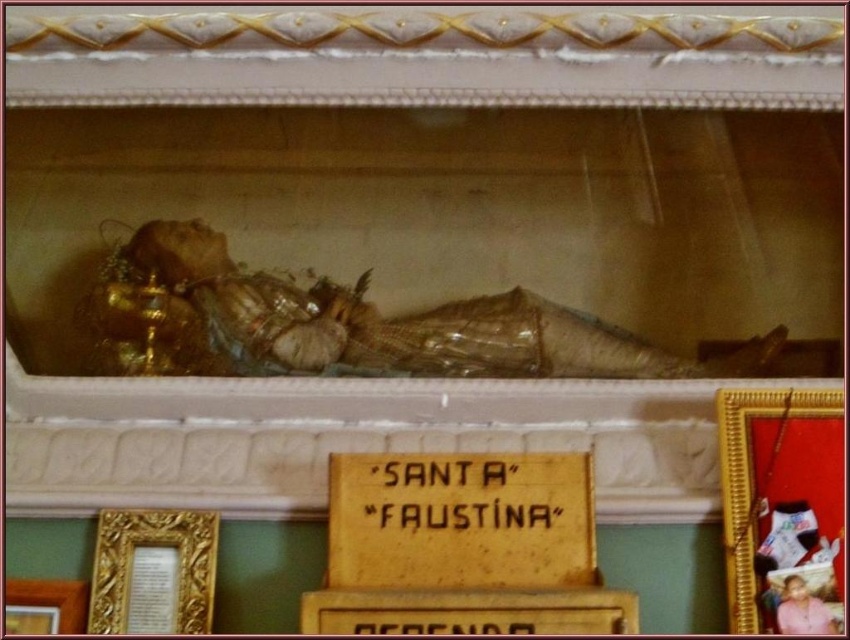
You are standing in front of the display case with the saint relic. Where is the yellow wood sign at center located relative to the plaque with the inscription SANTA FAUSTINA?

The yellow wood sign at center is located at point (x=460, y=520) relative to the plaque with the inscription SANTA FAUSTINA.

You are an art conservator examining the display case containing the preserved body of Saint Faustina. You notice a point marked at coordinates (153, 572). Based on the scene description, what object is located at this point?

The point at coordinates (153, 572) indicates the location of the gold ornate frame at lower left.